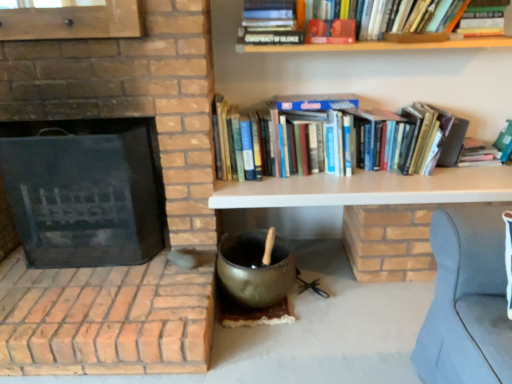
Question: In terms of width, does white matte shelf at upper center look wider or thinner when compared to black matte fireplace at left?

Choices:
 (A) thin
 (B) wide

Answer: (A)

Question: From the image's perspective, is white matte shelf at upper center located above or below black matte fireplace at left?

Choices:
 (A) below
 (B) above

Answer: (A)

Question: Which object is positioned closest to the matte black wok at center?

Choices:
 (A) white matte shelf at upper center
 (B) black matte fireplace at left
 (C) hardcover books at upper right

Answer: (A)

Question: Which is farther from the matte black wok at center?

Choices:
 (A) black matte fireplace at left
 (B) white matte shelf at upper center
 (C) hardcover books at upper right

Answer: (A)